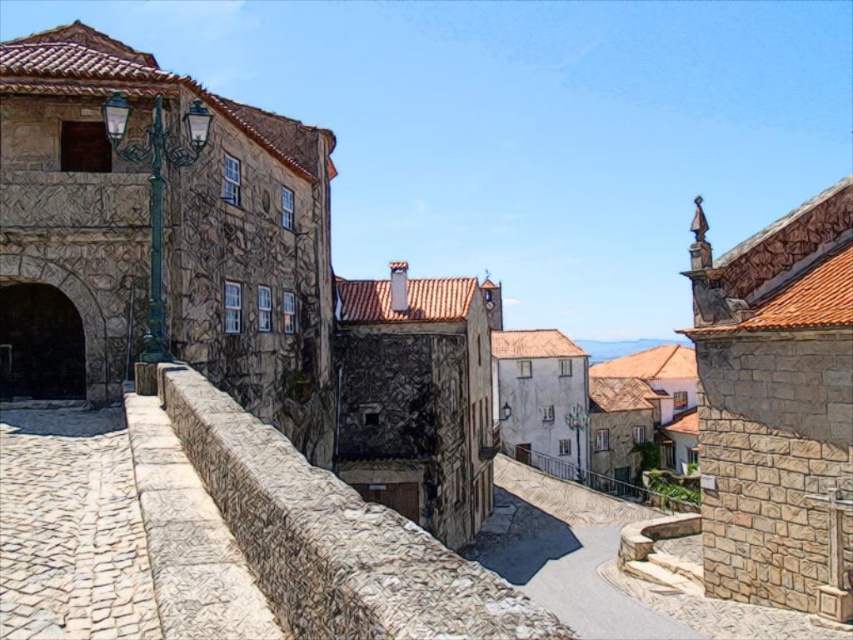
Question: Observing the image, what is the correct spatial positioning of rustic stone ledge at center in reference to stone paved path at center?

Choices:
 (A) below
 (B) above

Answer: (B)

Question: Is rustic stone ledge at center closer to the viewer compared to stone paved path at center?

Choices:
 (A) no
 (B) yes

Answer: (B)

Question: Among these points, which one is nearest to the camera?

Choices:
 (A) (392, 524)
 (B) (177, 589)

Answer: (A)

Question: Which point appears farthest from the camera in this image?

Choices:
 (A) (312, 468)
 (B) (257, 602)

Answer: (A)

Question: Is rustic stone ledge at center bigger than stone paved path at center?

Choices:
 (A) no
 (B) yes

Answer: (B)